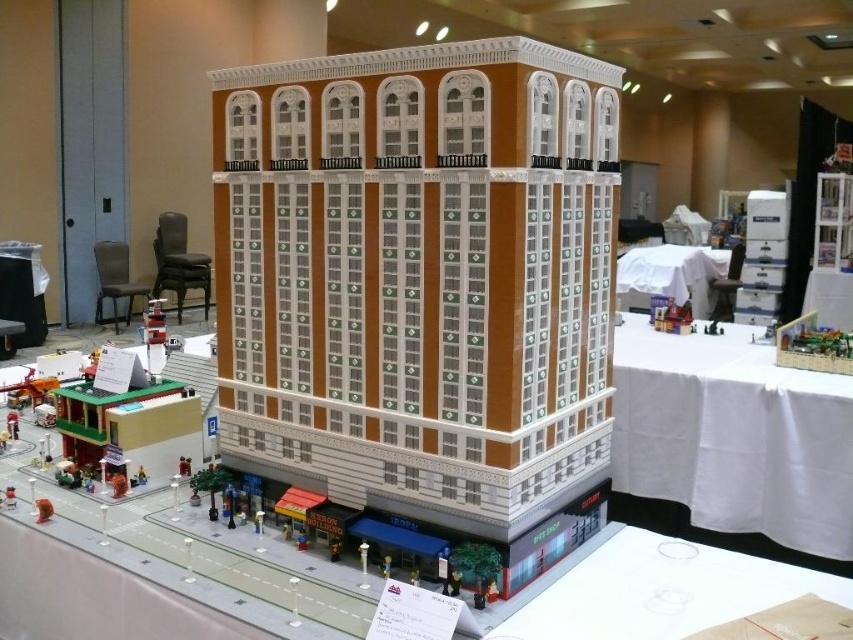
Is white glossy table at lower right below white fabric table at center?

Correct, white glossy table at lower right is located below white fabric table at center.

Can you confirm if white glossy table at lower right is thinner than white fabric table at center?

Yes, white glossy table at lower right is thinner than white fabric table at center.

This screenshot has width=853, height=640. In order to click on white glossy table at lower right in this screenshot , I will do `click(660, 589)`.

What are the coordinates of `white glossy table at lower right` in the screenshot? It's located at (660, 589).

What do you see at coordinates (419, 276) in the screenshot?
I see `brown lego building at center` at bounding box center [419, 276].

Who is positioned more to the left, brown lego building at center or white fabric table at center?

brown lego building at center is more to the left.

Image resolution: width=853 pixels, height=640 pixels. Identify the location of brown lego building at center. (419, 276).

What do you see at coordinates (733, 435) in the screenshot?
I see `white cloth at upper right` at bounding box center [733, 435].

Is white cloth at upper right further to camera compared to white fabric table at center?

No, white cloth at upper right is in front of white fabric table at center.

Does point (699, 449) come in front of point (637, 291)?

Yes.

At what (x,y) coordinates should I click in order to perform the action: click on white cloth at upper right. Please return your answer as a coordinate pair (x, y). This screenshot has width=853, height=640. Looking at the image, I should click on (733, 435).